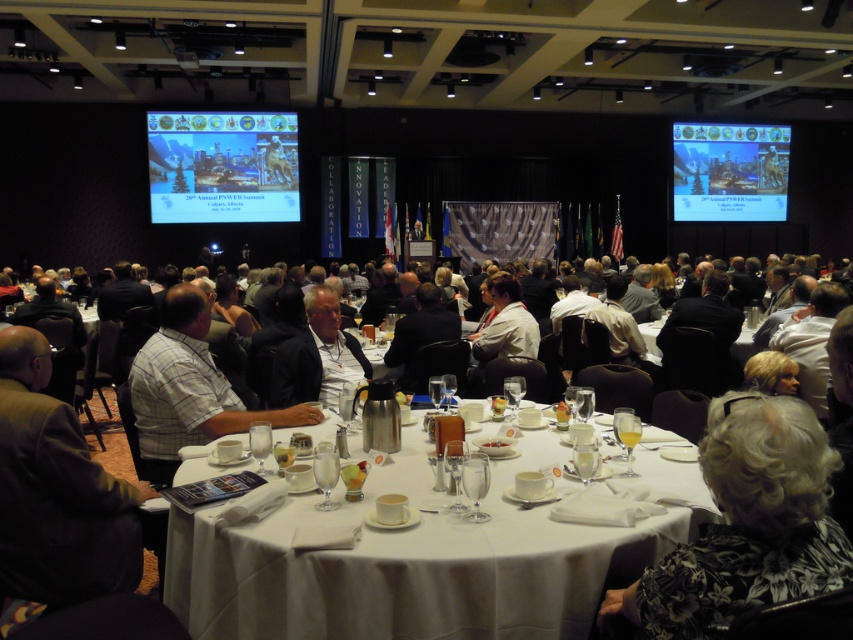
You are a photographer at the event and need to capture a photo of the gray floral dress at lower right and the white plastic table at center. Based on their positions, which object is closer to the camera?

The gray floral dress at lower right is below the white plastic table at center, so the white plastic table at center is closer to the camera.

You are organizing a presentation in this conference room and need to decide where to place your projector. Considering the matte plastic projector screen at upper right and the white plastic table at center, which object is larger and would be more suitable for projecting a presentation slide?

The matte plastic projector screen at upper right is bigger than the white plastic table at center, making it the more suitable option for projecting presentation slides.